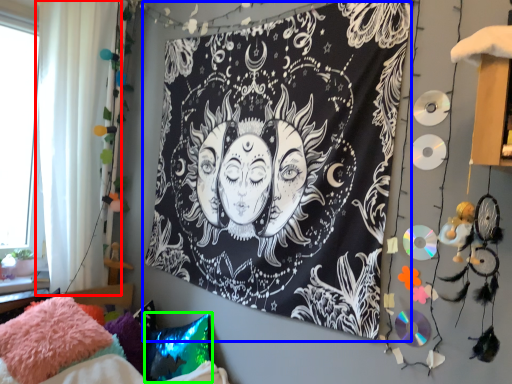
Question: Which object is the closest to the curtain (highlighted by a red box)? Choose among these: bulletin board (highlighted by a blue box) or pillow (highlighted by a green box).

Choices:
 (A) bulletin board
 (B) pillow

Answer: (A)